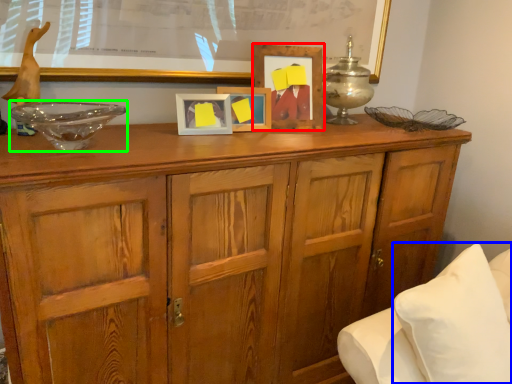
Question: Which object is positioned closest to picture frame (highlighted by a red box)? Select from pillow (highlighted by a blue box) and glass bowl (highlighted by a green box).

Choices:
 (A) pillow
 (B) glass bowl

Answer: (B)